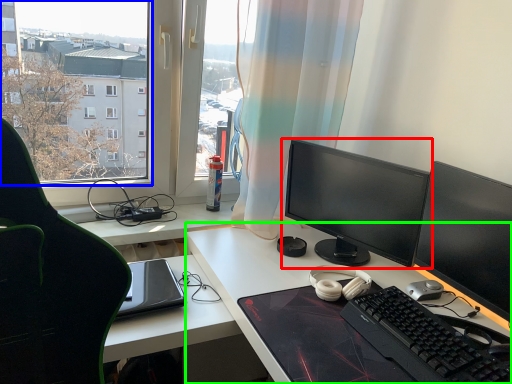
Question: Which object is the farthest from computer monitor (highlighted by a red box)? Choose among these: window screen (highlighted by a blue box) or desk (highlighted by a green box).

Choices:
 (A) window screen
 (B) desk

Answer: (A)